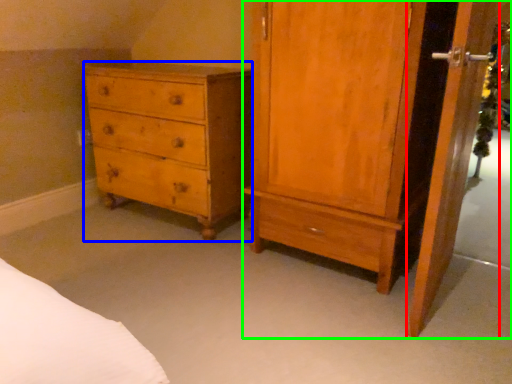
Question: Estimate the real-world distances between objects in this image. Which object is closer to screen door (highlighted by a red box), chest of drawers (highlighted by a blue box) or nightstand (highlighted by a green box)?

Choices:
 (A) chest of drawers
 (B) nightstand

Answer: (B)